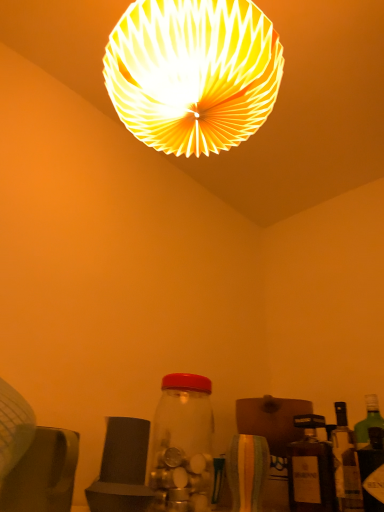
How much space does matte brown bottle at lower right, which ranks as the second bottle in left-to-right order, occupy horizontally?

It is 3.67 inches.

Where is `matte brown bottle at lower right, the 2th bottle positioned from the right`? The height and width of the screenshot is (512, 384). matte brown bottle at lower right, the 2th bottle positioned from the right is located at coordinates (310, 469).

From a real-world perspective, is transparent glass jar at center, the 3th bottle in the right-to-left sequence, below green glass bottle at right, which is the first bottle from right to left?

No, from a real-world perspective, transparent glass jar at center, the 3th bottle in the right-to-left sequence, is not beneath green glass bottle at right, which is the first bottle from right to left.

Which point is more forward, (197, 411) or (337, 490)?

The point (197, 411) is closer to the camera.

Is transparent glass jar at center, the 3th bottle in the right-to-left sequence, aimed at green glass bottle at right, the 3th bottle positioned from the left?

No, transparent glass jar at center, the 3th bottle in the right-to-left sequence, is not aimed at green glass bottle at right, the 3th bottle positioned from the left.

Considering the sizes of objects transparent glass jar at center, the 3th bottle in the right-to-left sequence, and green glass bottle at right, the 3th bottle positioned from the left, in the image provided, who is taller, transparent glass jar at center, the 3th bottle in the right-to-left sequence, or green glass bottle at right, the 3th bottle positioned from the left,?

Standing taller between the two is transparent glass jar at center, the 3th bottle in the right-to-left sequence.

Is point (303, 505) closer to camera compared to point (197, 463)?

That is False.

How much distance is there between matte brown bottle at lower right, which ranks as the second bottle in left-to-right order, and transparent glass jar at center, the 3th bottle in the right-to-left sequence?

The distance of matte brown bottle at lower right, which ranks as the second bottle in left-to-right order, from transparent glass jar at center, the 3th bottle in the right-to-left sequence, is 11.57 inches.

In the image, is matte brown bottle at lower right, which ranks as the second bottle in left-to-right order, on the left side or the right side of transparent glass jar at center, the 3th bottle in the right-to-left sequence?

In the image, matte brown bottle at lower right, which ranks as the second bottle in left-to-right order, appears on the right side of transparent glass jar at center, the 3th bottle in the right-to-left sequence.

Is matte brown bottle at lower right, which ranks as the second bottle in left-to-right order, looking in the opposite direction of transparent glass jar at center, the 3th bottle in the right-to-left sequence?

No, matte brown bottle at lower right, which ranks as the second bottle in left-to-right order, is not facing the opposite direction of transparent glass jar at center, the 3th bottle in the right-to-left sequence.

Which object is positioned more to the left, matte brown bottle at lower right, the 2th bottle positioned from the right, or white paper lampshade at upper center?

From the viewer's perspective, white paper lampshade at upper center appears more on the left side.

From the image's perspective, is matte brown bottle at lower right, the 2th bottle positioned from the right, located beneath white paper lampshade at upper center?

Correct, matte brown bottle at lower right, the 2th bottle positioned from the right, appears lower than white paper lampshade at upper center in the image.

Which object is closer to the camera taking this photo, matte brown bottle at lower right, the 2th bottle positioned from the right, or white paper lampshade at upper center?

white paper lampshade at upper center is more forward.

From the image's perspective, is green glass bottle at right, which is the first bottle from right to left, located above or below matte brown bottle at lower right, which ranks as the second bottle in left-to-right order?

From the image's perspective, green glass bottle at right, which is the first bottle from right to left, appears above matte brown bottle at lower right, which ranks as the second bottle in left-to-right order.

From the picture: Which of these two, green glass bottle at right, which is the first bottle from right to left, or matte brown bottle at lower right, which ranks as the second bottle in left-to-right order, is bigger?

matte brown bottle at lower right, which ranks as the second bottle in left-to-right order, is bigger.

From the image's perspective, which bottle is the 1st one above the matte brown bottle at lower right, the 2th bottle positioned from the right? Please provide its 2D coordinates.

[(346, 464)]

In the scene shown: Can you confirm if green glass bottle at right, the 3th bottle positioned from the left, is wider than matte brown bottle at lower right, the 2th bottle positioned from the right?

Incorrect, the width of green glass bottle at right, the 3th bottle positioned from the left, does not surpass that of matte brown bottle at lower right, the 2th bottle positioned from the right.

Consider the image. From a real-world perspective, is matte brown bottle at lower right, the 2th bottle positioned from the right, on top of green glass bottle at right, the 3th bottle positioned from the left?

No, from a real-world perspective, matte brown bottle at lower right, the 2th bottle positioned from the right, is not over green glass bottle at right, the 3th bottle positioned from the left

In the scene shown: Is green glass bottle at right, which is the first bottle from right to left, at the back of matte brown bottle at lower right, which ranks as the second bottle in left-to-right order?

No, green glass bottle at right, which is the first bottle from right to left, is not at the back of matte brown bottle at lower right, which ranks as the second bottle in left-to-right order.

From the image's perspective, would you say matte brown bottle at lower right, which ranks as the second bottle in left-to-right order, is shown under green glass bottle at right, which is the first bottle from right to left?

Indeed, from the image's perspective, matte brown bottle at lower right, which ranks as the second bottle in left-to-right order, is shown beneath green glass bottle at right, which is the first bottle from right to left.

Is transparent glass jar at center, the 3th bottle in the right-to-left sequence, far from matte brown bottle at lower right, the 2th bottle positioned from the right?

That's not correct — transparent glass jar at center, the 3th bottle in the right-to-left sequence, is a little close to matte brown bottle at lower right, the 2th bottle positioned from the right.

Does transparent glass jar at center, the 3th bottle in the right-to-left sequence, have a smaller size compared to matte brown bottle at lower right, the 2th bottle positioned from the right?

Incorrect, transparent glass jar at center, the 3th bottle in the right-to-left sequence, is not smaller in size than matte brown bottle at lower right, the 2th bottle positioned from the right.

Can you tell me how much transparent glass jar at center, the first bottle when ordered from left to right, and matte brown bottle at lower right, the 2th bottle positioned from the right, differ in facing direction?

The angle between the facing direction of transparent glass jar at center, the first bottle when ordered from left to right, and the facing direction of matte brown bottle at lower right, the 2th bottle positioned from the right, is 92 degrees.

From the picture: Which point is more distant from viewer, (150, 470) or (316, 459)?

The point (316, 459) is farther.

Considering the positions of objects transparent glass jar at center, the 3th bottle in the right-to-left sequence, and white paper lampshade at upper center in the image provided, who is in front, transparent glass jar at center, the 3th bottle in the right-to-left sequence, or white paper lampshade at upper center?

white paper lampshade at upper center.

Could you tell me if transparent glass jar at center, the first bottle when ordered from left to right, is facing white paper lampshade at upper center?

No, transparent glass jar at center, the first bottle when ordered from left to right, is not oriented towards white paper lampshade at upper center.

Between transparent glass jar at center, the 3th bottle in the right-to-left sequence, and white paper lampshade at upper center, which one has smaller width?

transparent glass jar at center, the 3th bottle in the right-to-left sequence.

The width and height of the screenshot is (384, 512). I want to click on bottle that is in front of the green glass bottle at right, which is the first bottle from right to left, so (x=182, y=445).

There is a matte brown bottle at lower right, which ranks as the second bottle in left-to-right order. What are the coordinates of `the 2nd bottle above it (from a real-world perspective)` in the screenshot? It's located at (182, 445).

When comparing their distances from white paper lampshade at upper center, does transparent glass jar at center, the 3th bottle in the right-to-left sequence, or matte brown bottle at lower right, which ranks as the second bottle in left-to-right order, seem closer?

The object closer to white paper lampshade at upper center is transparent glass jar at center, the 3th bottle in the right-to-left sequence.

Which object lies nearer to the anchor point green glass bottle at right, which is the first bottle from right to left, white paper lampshade at upper center or matte brown bottle at lower right, which ranks as the second bottle in left-to-right order?

matte brown bottle at lower right, which ranks as the second bottle in left-to-right order.

Estimate the real-world distances between objects in this image. Which object is further from green glass bottle at right, which is the first bottle from right to left, matte brown bottle at lower right, which ranks as the second bottle in left-to-right order, or white paper lampshade at upper center?

white paper lampshade at upper center.

Based on the photo, considering their positions, is green glass bottle at right, the 3th bottle positioned from the left, positioned closer to matte brown bottle at lower right, the 2th bottle positioned from the right, than white paper lampshade at upper center?

The object closer to matte brown bottle at lower right, the 2th bottle positioned from the right, is green glass bottle at right, the 3th bottle positioned from the left.

From the image, which object appears to be farther from transparent glass jar at center, the first bottle when ordered from left to right, matte brown bottle at lower right, which ranks as the second bottle in left-to-right order, or green glass bottle at right, which is the first bottle from right to left?

green glass bottle at right, which is the first bottle from right to left, is positioned further to the anchor transparent glass jar at center, the first bottle when ordered from left to right.

Based on their spatial positions, is transparent glass jar at center, the 3th bottle in the right-to-left sequence, or green glass bottle at right, the 3th bottle positioned from the left, further from matte brown bottle at lower right, which ranks as the second bottle in left-to-right order?

The object further to matte brown bottle at lower right, which ranks as the second bottle in left-to-right order, is transparent glass jar at center, the 3th bottle in the right-to-left sequence.

Based on their spatial positions, is green glass bottle at right, which is the first bottle from right to left, or matte brown bottle at lower right, which ranks as the second bottle in left-to-right order, closer to transparent glass jar at center, the 3th bottle in the right-to-left sequence?

The object closer to transparent glass jar at center, the 3th bottle in the right-to-left sequence, is matte brown bottle at lower right, which ranks as the second bottle in left-to-right order.

Estimate the real-world distances between objects in this image. Which object is further from transparent glass jar at center, the 3th bottle in the right-to-left sequence, matte brown bottle at lower right, which ranks as the second bottle in left-to-right order, or white paper lampshade at upper center?

white paper lampshade at upper center.

This screenshot has height=512, width=384. Identify the location of bottle between white paper lampshade at upper center and green glass bottle at right, which is the first bottle from right to left, in the up-down direction. (182, 445).

Locate an element on the screen. The height and width of the screenshot is (512, 384). bottle located between transparent glass jar at center, the first bottle when ordered from left to right, and green glass bottle at right, the 3th bottle positioned from the left, in the left-right direction is located at coordinates (310, 469).